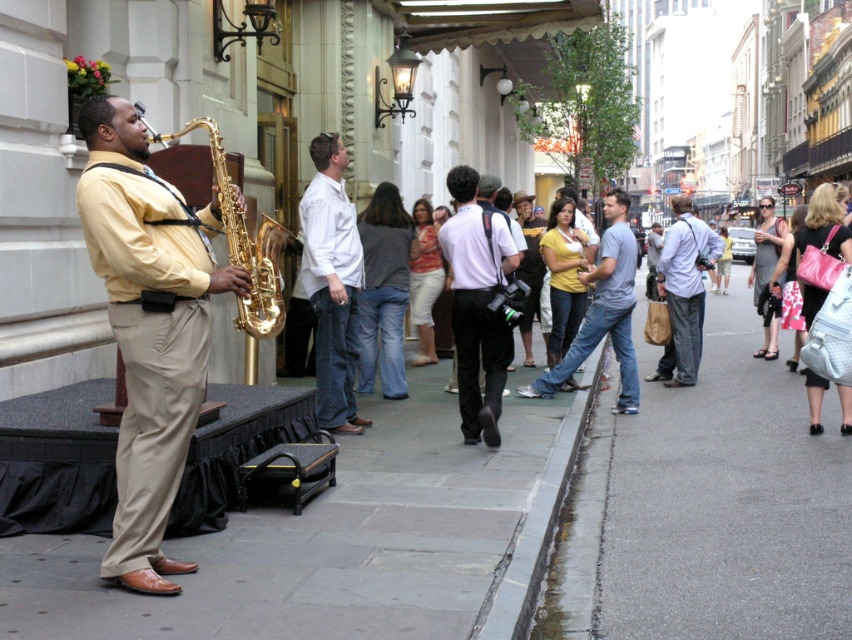
You are a photographer trying to capture the musician in the scene. Since the white matte shirt at center and light blue jeans at center are both visible, which clothing item will appear larger in your photo?

The white matte shirt at center will appear larger in the photo because it is bigger than the light blue jeans at center.

You are a street performer who just finished playing your saxophone. You need to place your matte gold saxophone at left back on the concrete at lower right. Can you move it directly in front of you without moving the saxophone aside?

The concrete at lower right is behind matte gold saxophone at left, so you cannot move the matte gold saxophone at left directly in front of you without moving it aside first.